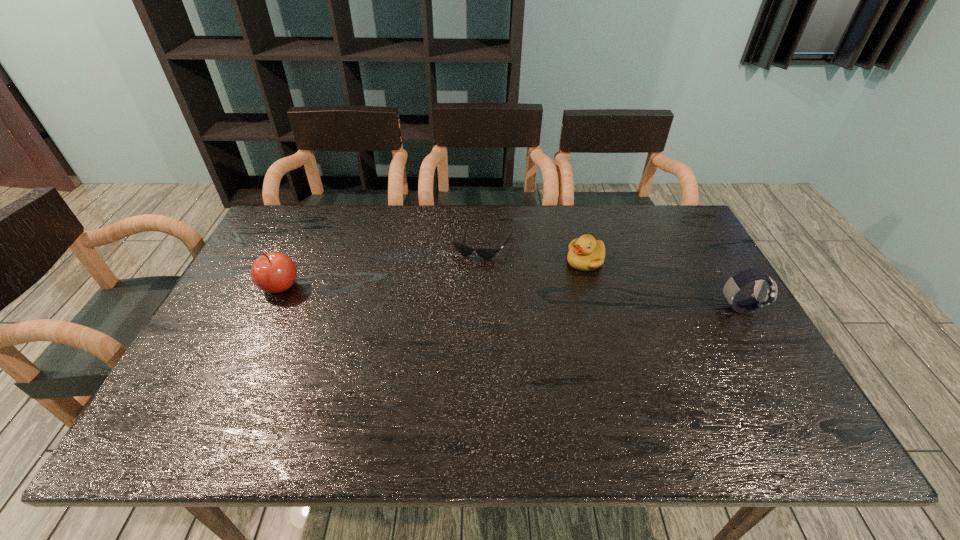
This screenshot has height=540, width=960. I want to click on vacant region located 0.130m on the front-facing side of the third object from right to left, so click(x=464, y=289).

You are a GUI agent. You are given a task and a screenshot of the screen. Output one action in this format:
    pyautogui.click(x=<x>, y=<y>)
    Task: Click on the vacant space located 0.150m on the front-facing side of the third object from right to left
    This screenshot has height=540, width=960.
    Given the screenshot: What is the action you would take?
    pyautogui.click(x=462, y=294)

Image resolution: width=960 pixels, height=540 pixels. I want to click on vacant space located on the front-facing side of the third object from right to left, so click(x=437, y=352).

Find the location of a particular element. The height and width of the screenshot is (540, 960). duckling situated at the far edge is located at coordinates (585, 253).

Locate an element on the screen. Image resolution: width=960 pixels, height=540 pixels. sunglasses that is at the far edge is located at coordinates (486, 253).

This screenshot has height=540, width=960. Identify the location of object that is at the left edge. (273, 272).

You are a GUI agent. You are given a task and a screenshot of the screen. Output one action in this format:
    pyautogui.click(x=<x>, y=<y>)
    Task: Click on the object that is at the right edge
    This screenshot has width=960, height=540.
    Given the screenshot: What is the action you would take?
    pyautogui.click(x=765, y=290)

You are a GUI agent. You are given a task and a screenshot of the screen. Output one action in this format:
    pyautogui.click(x=<x>, y=<y>)
    Task: Click on the vacant space at the far edge
    
    Given the screenshot: What is the action you would take?
    pyautogui.click(x=455, y=210)

I want to click on vacant space at the near edge of the desktop, so point(654,378).

In the image, there is a desktop. Where is `free space at the left edge`? The height and width of the screenshot is (540, 960). free space at the left edge is located at coordinates (296, 262).